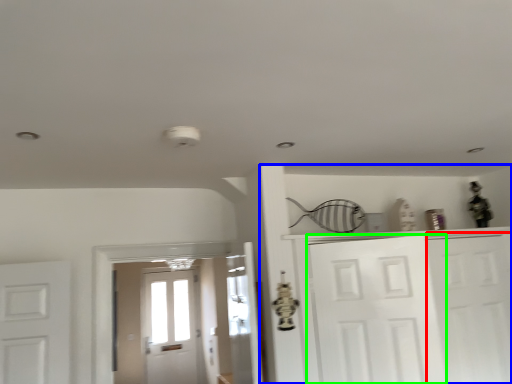
Question: Which object is positioned farthest from door (highlighted by a red box)? Select from dresser (highlighted by a blue box) and door (highlighted by a green box).

Choices:
 (A) dresser
 (B) door

Answer: (A)